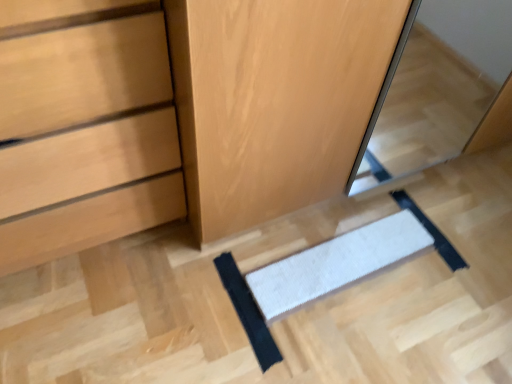
What do you see at coordinates (248, 311) in the screenshot?
I see `white textured mat at center, the 1th doormat viewed from the left` at bounding box center [248, 311].

You are a GUI agent. You are given a task and a screenshot of the screen. Output one action in this format:
    pyautogui.click(x=<x>, y=<y>)
    Task: Click on the white textured mat at center, placed as the second doormat when sorted from left to right
    
    Given the screenshot: What is the action you would take?
    pyautogui.click(x=336, y=263)

Would you say matte wood chest of drawers at lower left is a long distance from white textured mat at center, the 2th doormat viewed from the right?

They are positioned close to each other.

Who is taller, matte wood chest of drawers at lower left or white textured mat at center, the 1th doormat viewed from the left?

matte wood chest of drawers at lower left is taller.

From the picture: Between matte wood chest of drawers at lower left and white textured mat at center, the 2th doormat viewed from the right, which one has larger size?

Bigger between the two is matte wood chest of drawers at lower left.

From a real-world perspective, which is physically below, wooden dresser at center or white textured mat at center, the 2th doormat viewed from the right?

white textured mat at center, the 2th doormat viewed from the right, from a real-world perspective.

Which point is more distant from viewer, (351, 100) or (267, 367)?

The point (267, 367) is more distant.

Image resolution: width=512 pixels, height=384 pixels. Find the location of `dresser above the white textured mat at center, the 1th doormat viewed from the left (from a real-world perspective)`. dresser above the white textured mat at center, the 1th doormat viewed from the left (from a real-world perspective) is located at coordinates (187, 117).

Is wooden dresser at center bigger than white textured mat at center, the 1th doormat viewed from the left?

Yes.

Does wooden dresser at center have a smaller size compared to matte wood chest of drawers at lower left?

No, wooden dresser at center is not smaller than matte wood chest of drawers at lower left.

From the image's perspective, between wooden dresser at center and matte wood chest of drawers at lower left, who is located below?

matte wood chest of drawers at lower left appears lower in the image.

Is wooden dresser at center in front of matte wood chest of drawers at lower left?

That is False.

From a real-world perspective, is wooden dresser at center positioned under matte wood chest of drawers at lower left based on gravity?

Yes, from a real-world perspective, wooden dresser at center is under matte wood chest of drawers at lower left.

Which is more to the left, white textured mat at center, the 2th doormat viewed from the right, or matte wood chest of drawers at lower left?

matte wood chest of drawers at lower left.

Is white textured mat at center, the 2th doormat viewed from the right, wider or thinner than matte wood chest of drawers at lower left?

Considering their sizes, white textured mat at center, the 2th doormat viewed from the right, looks slimmer than matte wood chest of drawers at lower left.

Which is in front, point (240, 309) or point (62, 57)?

The point (62, 57) is closer to the camera.

You are a GUI agent. You are given a task and a screenshot of the screen. Output one action in this format:
    pyautogui.click(x=<x>, y=<y>)
    Task: Click on the dresser above the white textured mat at center, the 2th doormat viewed from the right (from a real-world perspective)
    The image size is (512, 384).
    Given the screenshot: What is the action you would take?
    pyautogui.click(x=187, y=117)

From the image's perspective, is white textured mat at center, the 1th doormat viewed from the left, below wooden dresser at center?

Indeed, from the image's perspective, white textured mat at center, the 1th doormat viewed from the left, is shown beneath wooden dresser at center.

What's the angular difference between white textured mat at center, the 2th doormat viewed from the right, and wooden dresser at center's facing directions?

0.182 degrees.

In the scene shown: Would you say white textured mat at center, the 1th doormat viewed from the left, is inside or outside wooden dresser at center?

white textured mat at center, the 1th doormat viewed from the left, is spatially situated outside wooden dresser at center.

In the image, is white textured mat at center, the 2th doormat viewed from the right, positioned in front of or behind white textured mat at center, placed as the 1th doormat when sorted from right to left?

Clearly, white textured mat at center, the 2th doormat viewed from the right, is in front of white textured mat at center, placed as the 1th doormat when sorted from right to left.

Is white textured mat at center, the 1th doormat viewed from the left, shorter than white textured mat at center, placed as the 1th doormat when sorted from right to left?

No.

Is white textured mat at center, placed as the 1th doormat when sorted from right to left, completely or partially inside white textured mat at center, the 2th doormat viewed from the right?

No, white textured mat at center, placed as the 1th doormat when sorted from right to left, is not surrounded by white textured mat at center, the 2th doormat viewed from the right.

Could you tell me if white textured mat at center, the 1th doormat viewed from the left, is facing white textured mat at center, placed as the 1th doormat when sorted from right to left?

No.

Is point (280, 284) positioned after point (249, 306)?

That is True.

Between white textured mat at center, placed as the 1th doormat when sorted from right to left, and white textured mat at center, the 1th doormat viewed from the left, which one appears on the right side from the viewer's perspective?

white textured mat at center, placed as the 1th doormat when sorted from right to left.

How distant is white textured mat at center, placed as the 1th doormat when sorted from right to left, from white textured mat at center, the 1th doormat viewed from the left?

white textured mat at center, placed as the 1th doormat when sorted from right to left, and white textured mat at center, the 1th doormat viewed from the left, are 22.68 centimeters apart from each other.

Can we say white textured mat at center, placed as the 1th doormat when sorted from right to left, lies outside white textured mat at center, the 1th doormat viewed from the left?

That's correct, white textured mat at center, placed as the 1th doormat when sorted from right to left, is outside of white textured mat at center, the 1th doormat viewed from the left.

Locate an element on the screen. Image resolution: width=512 pixels, height=384 pixels. the 1st doormat counting from the right of the matte wood chest of drawers at lower left is located at coordinates (248, 311).

From the image's perspective, which doormat is the 2nd one below the wooden dresser at center? Please provide its 2D coordinates.

[(248, 311)]

Which object lies further to the anchor point white textured mat at center, placed as the second doormat when sorted from left to right, matte wood chest of drawers at lower left or white textured mat at center, the 1th doormat viewed from the left?

matte wood chest of drawers at lower left.

Based on their spatial positions, is white textured mat at center, the 1th doormat viewed from the left, or white textured mat at center, placed as the 1th doormat when sorted from right to left, closer to wooden dresser at center?

Based on the image, white textured mat at center, placed as the 1th doormat when sorted from right to left, appears to be nearer to wooden dresser at center.

Looking at the image, which one is located closer to white textured mat at center, placed as the second doormat when sorted from left to right, wooden dresser at center or white textured mat at center, the 2th doormat viewed from the right?

white textured mat at center, the 2th doormat viewed from the right, lies closer to white textured mat at center, placed as the second doormat when sorted from left to right, than the other object.

Which object lies further to the anchor point matte wood chest of drawers at lower left, white textured mat at center, placed as the second doormat when sorted from left to right, or white textured mat at center, the 1th doormat viewed from the left?

white textured mat at center, placed as the second doormat when sorted from left to right, lies further to matte wood chest of drawers at lower left than the other object.

Which object lies nearer to the anchor point matte wood chest of drawers at lower left, white textured mat at center, placed as the second doormat when sorted from left to right, or wooden dresser at center?

wooden dresser at center lies closer to matte wood chest of drawers at lower left than the other object.

Which object lies nearer to the anchor point white textured mat at center, the 2th doormat viewed from the right, wooden dresser at center or matte wood chest of drawers at lower left?

wooden dresser at center is closer to white textured mat at center, the 2th doormat viewed from the right.

From the image, which object appears to be farther from white textured mat at center, placed as the 1th doormat when sorted from right to left, white textured mat at center, the 1th doormat viewed from the left, or matte wood chest of drawers at lower left?

matte wood chest of drawers at lower left is further to white textured mat at center, placed as the 1th doormat when sorted from right to left.

Considering their positions, is white textured mat at center, placed as the 1th doormat when sorted from right to left, positioned further to white textured mat at center, the 2th doormat viewed from the right, than matte wood chest of drawers at lower left?

matte wood chest of drawers at lower left is further to white textured mat at center, the 2th doormat viewed from the right.

Identify the location of doormat between wooden dresser at center and white textured mat at center, the 2th doormat viewed from the right, from top to bottom. The width and height of the screenshot is (512, 384). (336, 263).

Where is `doormat between matte wood chest of drawers at lower left and white textured mat at center, placed as the 1th doormat when sorted from right to left, from left to right`? Image resolution: width=512 pixels, height=384 pixels. doormat between matte wood chest of drawers at lower left and white textured mat at center, placed as the 1th doormat when sorted from right to left, from left to right is located at coordinates (248, 311).